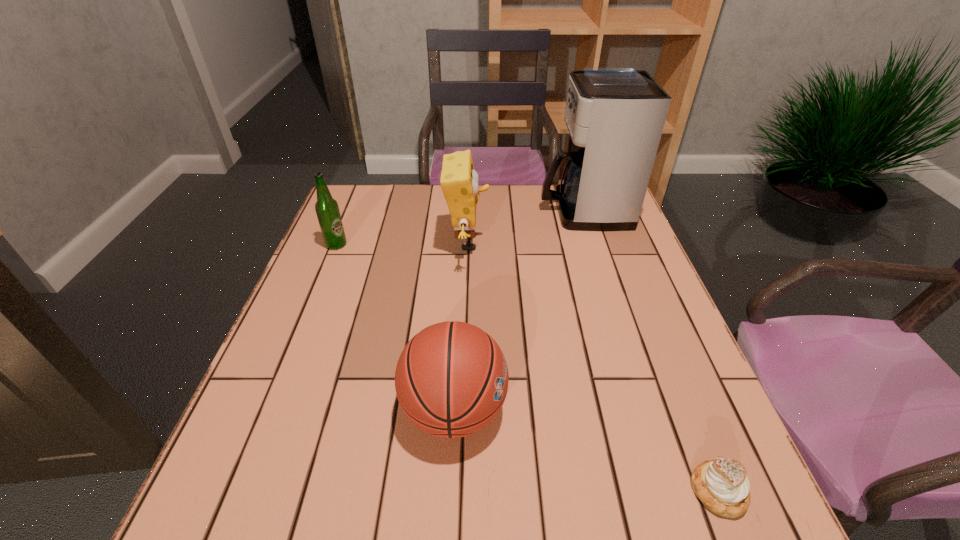
Where is `vacant space located 0.330m on the label of the leftmost object`? vacant space located 0.330m on the label of the leftmost object is located at coordinates (466, 245).

Find the location of a particular element. The image size is (960, 540). vacant space located 0.380m on the logo side of the basketball is located at coordinates (707, 410).

At what (x,y) coordinates should I click in order to perform the action: click on vacant space located 0.120m on the back of the shortest object. Please return your answer as a coordinate pair (x, y). This screenshot has height=540, width=960. Looking at the image, I should click on (684, 404).

Where is `coffee maker at the far edge`? coffee maker at the far edge is located at coordinates (615, 117).

I want to click on sponge situated at the far edge, so click(x=459, y=181).

Locate an element on the screen. The image size is (960, 540). object located at the near edge is located at coordinates (722, 485).

I want to click on object that is at the left edge, so click(x=327, y=209).

Identify the location of coffee maker that is at the right edge. The width and height of the screenshot is (960, 540). (615, 117).

You are a GUI agent. You are given a task and a screenshot of the screen. Output one action in this format:
    pyautogui.click(x=<x>, y=<y>)
    Task: Click on the pastry that is at the right edge
    This screenshot has height=540, width=960.
    Given the screenshot: What is the action you would take?
    pyautogui.click(x=722, y=485)

Locate an element on the screen. Image resolution: width=960 pixels, height=540 pixels. object that is at the far right corner is located at coordinates (615, 117).